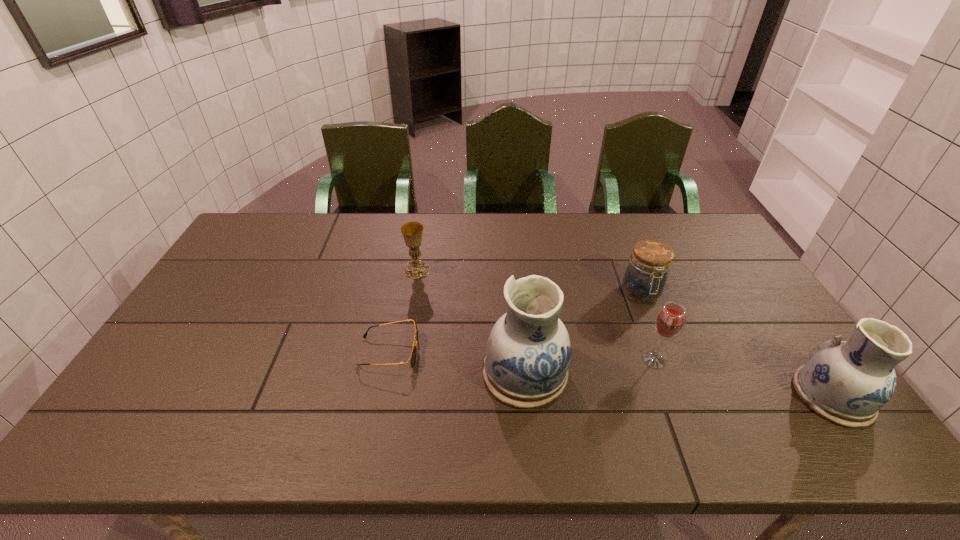
Identify the location of free space located 0.220m on the lid of the jar. (672, 370).

You are a GUI agent. You are given a task and a screenshot of the screen. Output one action in this format:
    pyautogui.click(x=<x>, y=<y>)
    Task: Click on the free region located 0.320m on the left of the chalice
    This screenshot has width=960, height=540.
    Given the screenshot: What is the action you would take?
    pyautogui.click(x=306, y=270)

Where is `vacant space located 0.050m on the right of the wineglass`? vacant space located 0.050m on the right of the wineglass is located at coordinates (687, 360).

This screenshot has height=540, width=960. I want to click on free spot located 0.130m on the front-facing side of the sunglasses, so click(467, 352).

Locate an element on the screen. The image size is (960, 540). object that is at the right edge is located at coordinates (847, 382).

Identify the location of object that is at the near right corner. (847, 382).

In the image, there is a desktop. Where is `vacant area at the far edge`? vacant area at the far edge is located at coordinates (507, 224).

The height and width of the screenshot is (540, 960). In the image, there is a desktop. Find the location of `vacant space at the near edge`. vacant space at the near edge is located at coordinates (612, 394).

Locate an element on the screen. The image size is (960, 540). vacant area at the right edge of the desktop is located at coordinates (711, 288).

The height and width of the screenshot is (540, 960). I want to click on vacant space at the far right corner of the desktop, so click(x=696, y=221).